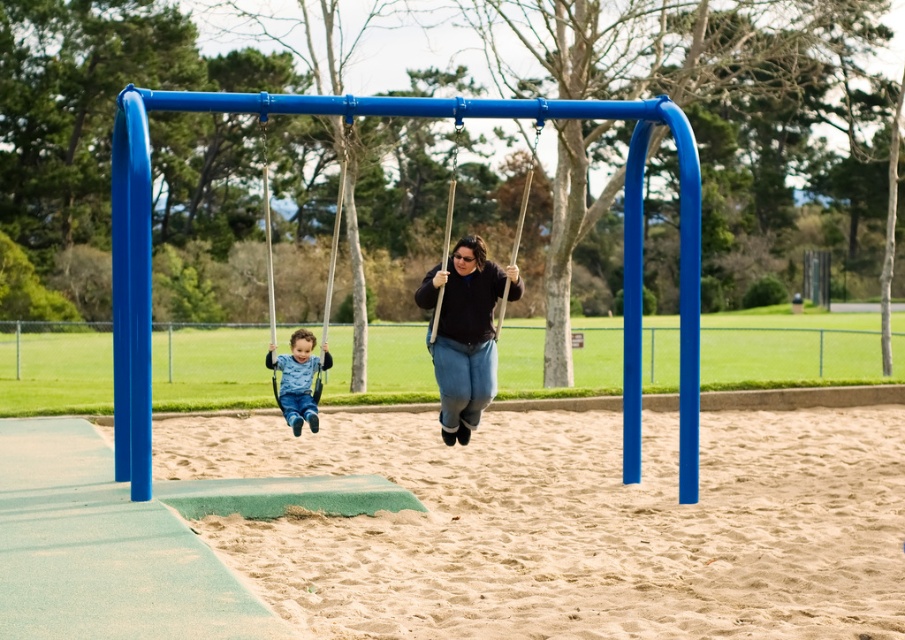
You are a maintenance worker checking the distance between the swings for safety. The safety guideline requires a minimum of 3 meters between swings. Are the matte blue swing at left and matte black swing at center meeting this requirement?

The matte blue swing at left and matte black swing at center are 3.39 meters apart from each other, which exceeds the 3 meters requirement. Therefore, they are meeting the safety guideline.